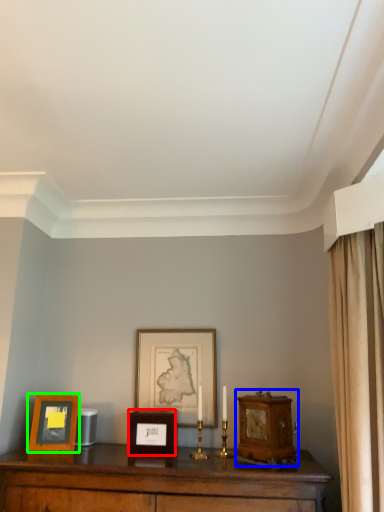
Question: Which object is the farthest from picture frame (highlighted by a red box)? Choose among these: alarm clock (highlighted by a blue box) or picture frame (highlighted by a green box).

Choices:
 (A) alarm clock
 (B) picture frame

Answer: (A)